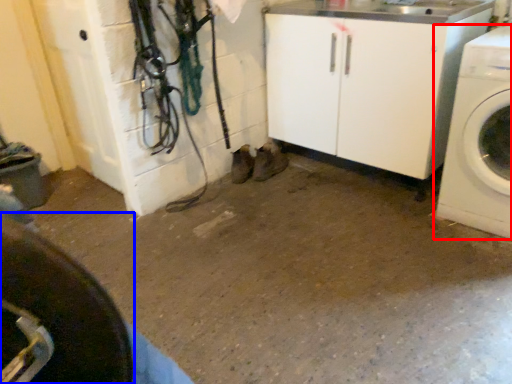
Question: Which object appears farthest to the camera in this image, washing machine (highlighted by a red box) or tire (highlighted by a blue box)?

Choices:
 (A) washing machine
 (B) tire

Answer: (A)